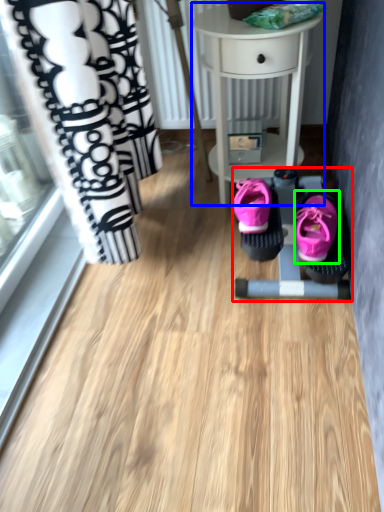
Question: Which object is positioned farthest from baby carriage (highlighted by a red box)? Select from table (highlighted by a blue box) and footwear (highlighted by a green box).

Choices:
 (A) table
 (B) footwear

Answer: (A)